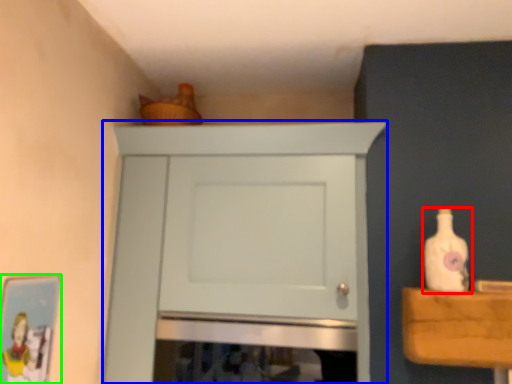
Question: Which object is positioned closest to bottle (highlighted by a red box)? Select from cupboard (highlighted by a blue box) and picture frame (highlighted by a green box).

Choices:
 (A) cupboard
 (B) picture frame

Answer: (A)